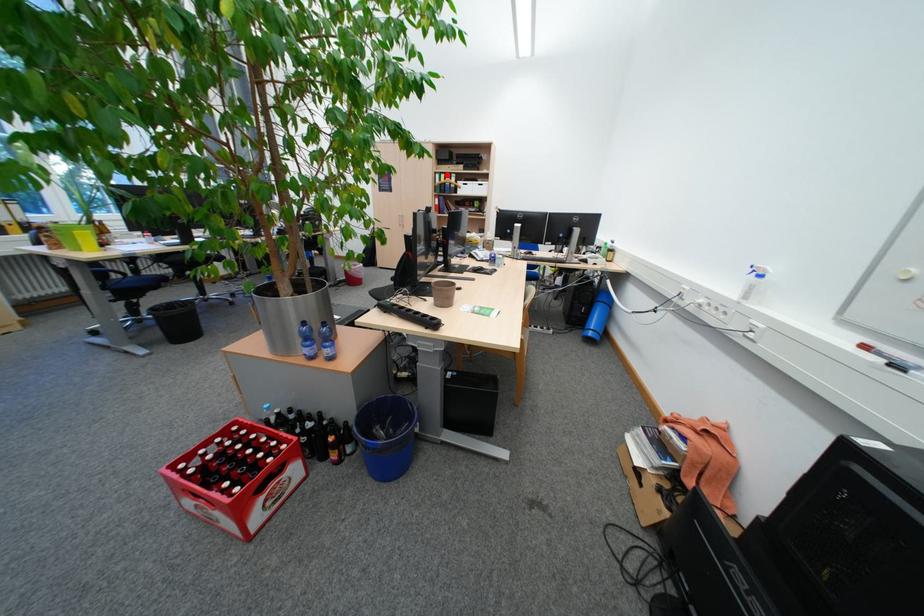
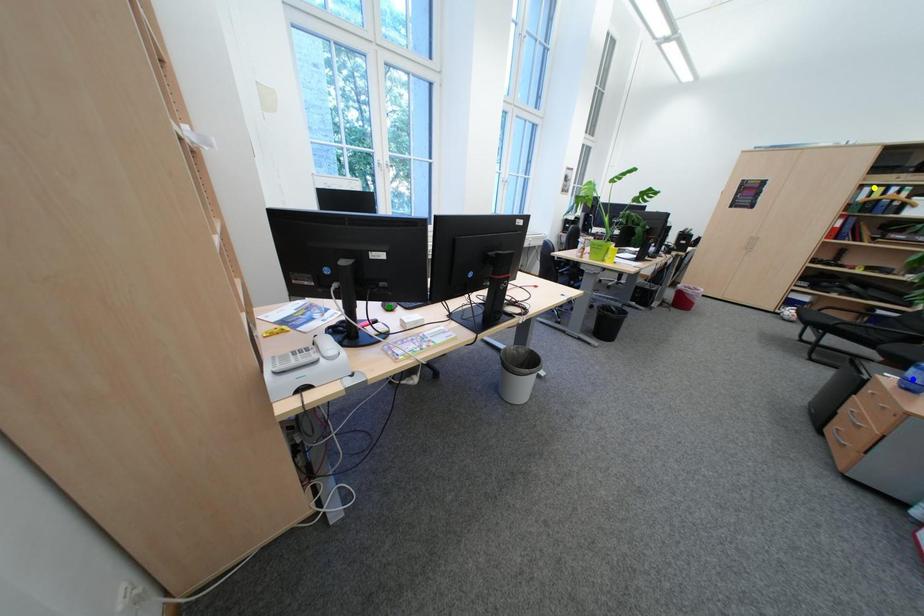
Question: I am providing you with two images of the same scene from different viewpoints. A red point is marked on the first image. You are given multiple points on the second image. Which point in image 2 is actually the same real-world point as the red point in image 1?

Choices:
 (A) yellow point
 (B) green point
 (C) blue point

Answer: (A)